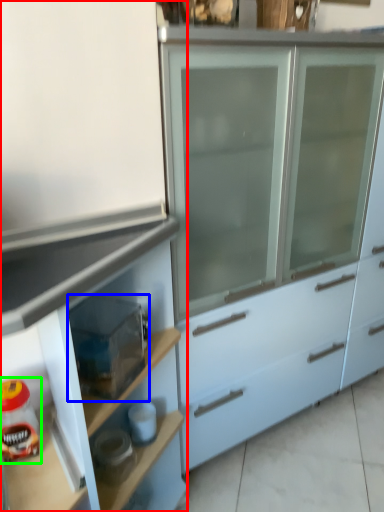
Question: Estimate the real-world distances between objects in this image. Which object is closer to cabinetry (highlighted by a red box), appliance (highlighted by a blue box) or food (highlighted by a green box)?

Choices:
 (A) appliance
 (B) food

Answer: (A)